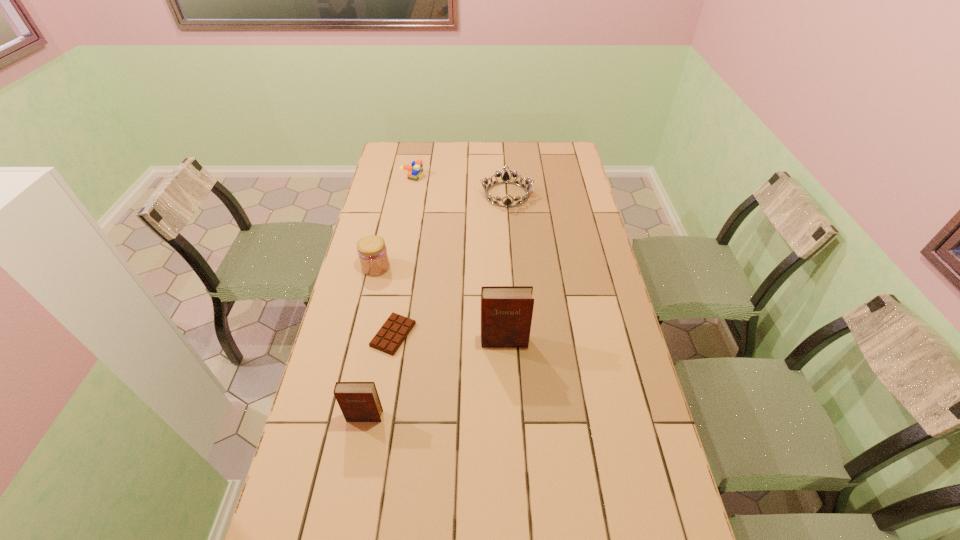
In the current image, all diarys are evenly spaced. To maintain this equal spacing, where should an additional diary be placed on the right? Please point out a free spot. Please provide its 2D coordinates. Your answer should be formatted as a tuple, i.e. [(x, y)], where the tuple contains the x and y coordinates of a point satisfying the conditions above.

[(612, 283)]